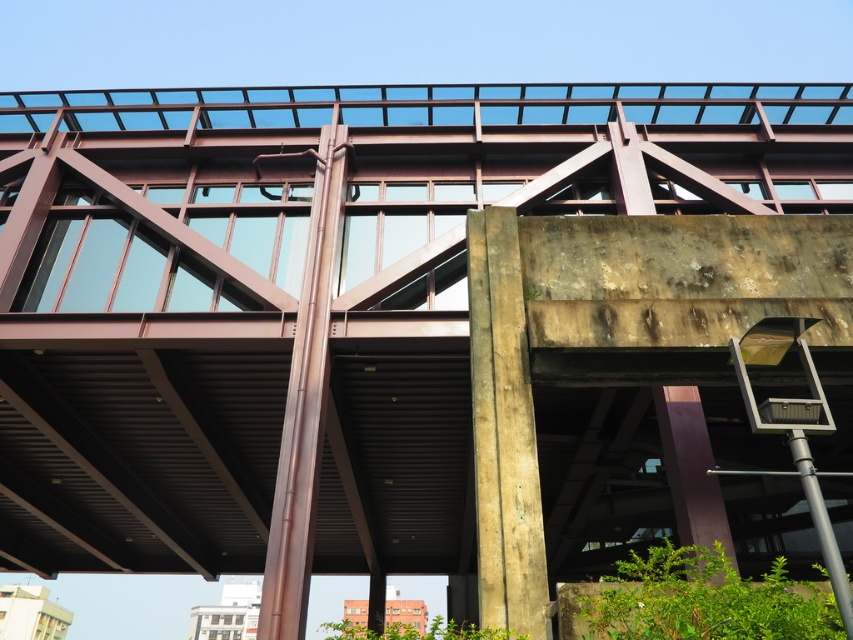
You are a maintenance worker standing at the base of the elevated structure. You need to locate the concrete textured pillar at center. According to the 2D coordinates given, where should you look relative to the structure?

The concrete textured pillar at center is located at the 2D coordinates point (503, 432), which corresponds to the central area of the structure.

You are a maintenance worker needing to inspect both pillars. Given that your ladder is 5 meters long, can you safely reach from the concrete textured pillar at center to the purple glossy pillar at lower right without moving the ladder?

The distance between the concrete textured pillar at center and the purple glossy pillar at lower right is 4.71 meters. Since the ladder is 5 meters long, it can span the gap safely, so yes, you can reach both pillars without moving the ladder.